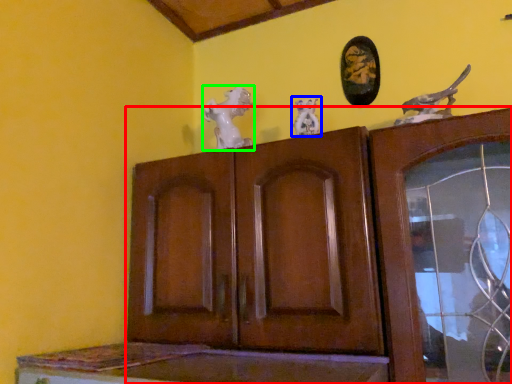
Question: Which object is positioned farthest from cupboard (highlighted by a red box)? Select from animal sculpture (highlighted by a blue box) and animal (highlighted by a green box).

Choices:
 (A) animal sculpture
 (B) animal

Answer: (A)